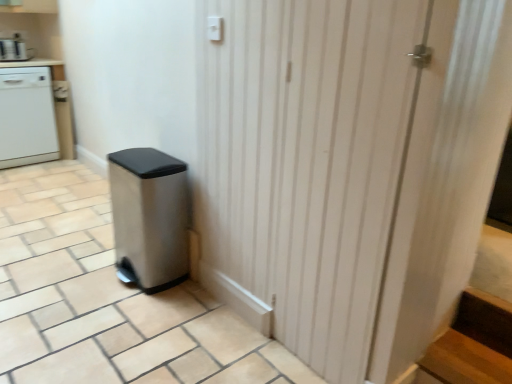
The image size is (512, 384). Find the location of `vacant space situated on the left part of white wood screen door at center`. vacant space situated on the left part of white wood screen door at center is located at coordinates (160, 331).